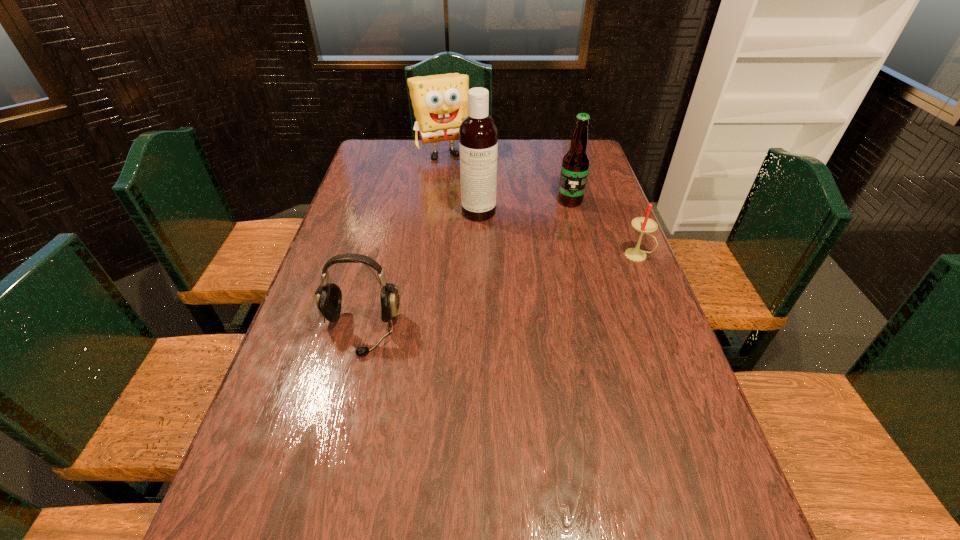
Locate an element on the screen. The height and width of the screenshot is (540, 960). headset is located at coordinates coord(328,296).

At what (x,y) coordinates should I click in order to perform the action: click on the rightmost object. Please return your answer as a coordinate pair (x, y). The image size is (960, 540). Looking at the image, I should click on (643, 225).

Where is `the fourth farthest object`? This screenshot has width=960, height=540. the fourth farthest object is located at coordinates (643, 225).

Locate an element on the screen. The width and height of the screenshot is (960, 540). the farthest object is located at coordinates (440, 102).

Where is `beer bottle`? The height and width of the screenshot is (540, 960). beer bottle is located at coordinates [x=575, y=166].

The image size is (960, 540). I want to click on the tallest object, so click(478, 133).

Find the location of a particular element. The height and width of the screenshot is (540, 960). vacant region located 0.210m with the microphone on the side of the nearest object is located at coordinates (331, 446).

Locate an element on the screen. The height and width of the screenshot is (540, 960). free region located 0.220m on the left of the second nearest object is located at coordinates (549, 255).

Identify the location of vacant space situated on the face of the sponge. (467, 190).

Image resolution: width=960 pixels, height=540 pixels. Find the location of `vacant space located 0.230m on the face of the sponge`. vacant space located 0.230m on the face of the sponge is located at coordinates (469, 194).